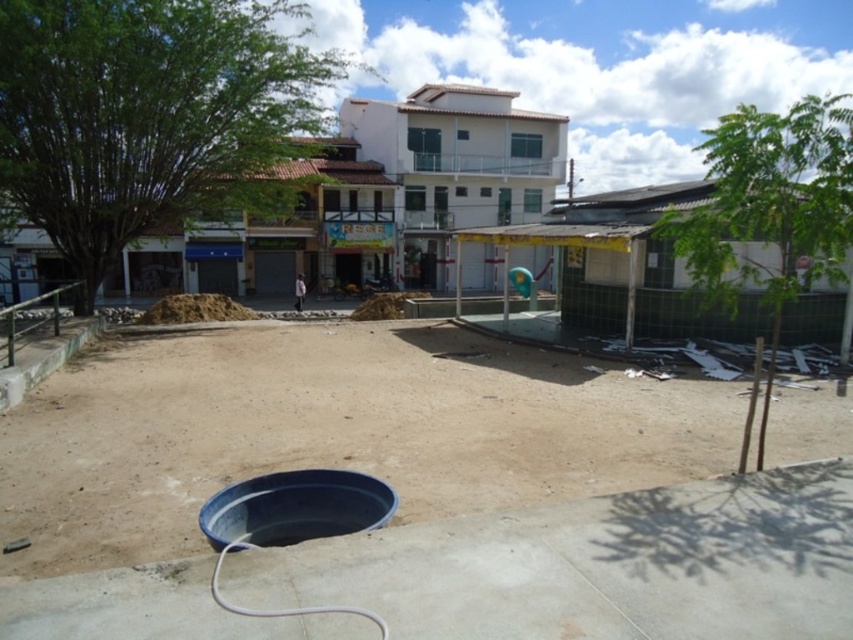
Who is positioned more to the left, brown sandy dirt field at center or green leafy tree at upper left?

green leafy tree at upper left is more to the left.

Is brown sandy dirt field at center taller than green leafy tree at upper left?

Incorrect, brown sandy dirt field at center's height is not larger of green leafy tree at upper left's.

Is point (135, 490) farther from viewer compared to point (106, 124)?

No, it is in front of (106, 124).

This screenshot has width=853, height=640. I want to click on brown sandy dirt field at center, so click(x=331, y=429).

Is green leafy tree at upper left closer to the viewer compared to green leafy tree at right?

No, it is not.

Which is behind, point (339, 65) or point (733, 112)?

Point (733, 112)

At what (x,y) coordinates should I click in order to perform the action: click on green leafy tree at upper left. Please return your answer as a coordinate pair (x, y). The height and width of the screenshot is (640, 853). Looking at the image, I should click on (149, 118).

Where is `green leafy tree at upper left`? This screenshot has height=640, width=853. green leafy tree at upper left is located at coordinates (149, 118).

Which is below, brown sandy dirt field at center or green leafy tree at right?

Positioned lower is brown sandy dirt field at center.

Does brown sandy dirt field at center appear over green leafy tree at right?

No.

What do you see at coordinates (331, 429) in the screenshot?
I see `brown sandy dirt field at center` at bounding box center [331, 429].

Where is `brown sandy dirt field at center`? The height and width of the screenshot is (640, 853). brown sandy dirt field at center is located at coordinates (331, 429).